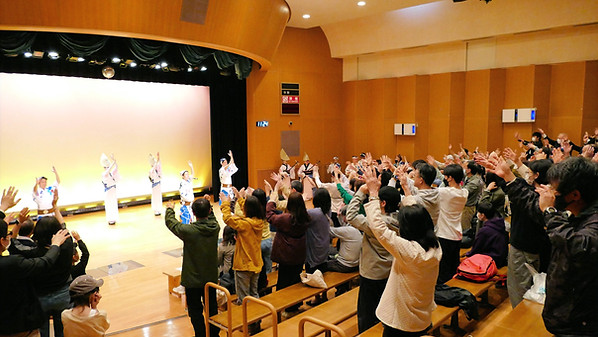
Find the location of `wall`. wall is located at coordinates (462, 136).